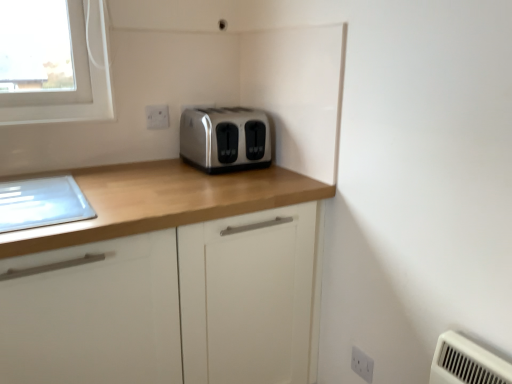
Question: Considering the relative positions of white plastic electric outlet at upper center, acting as the first electric outlet starting from the top, and satin silver toaster at center in the image provided, is white plastic electric outlet at upper center, acting as the first electric outlet starting from the top, to the right of satin silver toaster at center from the viewer's perspective?

Choices:
 (A) no
 (B) yes

Answer: (A)

Question: Is white plastic electric outlet at upper center, positioned as the 1th electric outlet in left-to-right order, aimed at satin silver toaster at center?

Choices:
 (A) yes
 (B) no

Answer: (B)

Question: Is the depth of white plastic electric outlet at upper center, positioned as the 1th electric outlet in left-to-right order, greater than that of satin silver toaster at center?

Choices:
 (A) no
 (B) yes

Answer: (B)

Question: Considering the relative sizes of white plastic electric outlet at upper center, which is the 2th electric outlet in bottom-to-top order, and satin silver toaster at center in the image provided, is white plastic electric outlet at upper center, which is the 2th electric outlet in bottom-to-top order, taller than satin silver toaster at center?

Choices:
 (A) no
 (B) yes

Answer: (A)

Question: Are white plastic electric outlet at upper center, which is the 2th electric outlet in bottom-to-top order, and satin silver toaster at center located far from each other?

Choices:
 (A) yes
 (B) no

Answer: (B)

Question: Considering the relative sizes of white plastic electric outlet at upper center, which is the second electric outlet from front to back, and satin silver toaster at center in the image provided, is white plastic electric outlet at upper center, which is the second electric outlet from front to back, thinner than satin silver toaster at center?

Choices:
 (A) yes
 (B) no

Answer: (A)

Question: From the image's perspective, is white plastic electric outlet at lower right, arranged as the 1th electric outlet when viewed from the front, beneath matte wood cabinet at center?

Choices:
 (A) no
 (B) yes

Answer: (B)

Question: From a real-world perspective, is white plastic electric outlet at lower right, the 2th electric outlet in the back-to-front sequence, physically above matte wood cabinet at center?

Choices:
 (A) yes
 (B) no

Answer: (B)

Question: Does white plastic electric outlet at lower right, acting as the 1th electric outlet starting from the right, lie behind matte wood cabinet at center?

Choices:
 (A) no
 (B) yes

Answer: (B)

Question: Is white plastic electric outlet at lower right, which is counted as the 2th electric outlet, starting from the left, aimed at matte wood cabinet at center?

Choices:
 (A) no
 (B) yes

Answer: (A)

Question: Would you say white plastic electric outlet at lower right, the 2th electric outlet in the back-to-front sequence, is outside matte wood cabinet at center?

Choices:
 (A) no
 (B) yes

Answer: (B)

Question: From a real-world perspective, is white plastic electric outlet at lower right, acting as the 1th electric outlet starting from the right, located beneath matte wood cabinet at center?

Choices:
 (A) no
 (B) yes

Answer: (B)

Question: Considering the relative sizes of white plastic electric outlet at lower right, arranged as the 1th electric outlet when viewed from the front, and white plastic electric outlet at upper center, acting as the first electric outlet starting from the top, in the image provided, is white plastic electric outlet at lower right, arranged as the 1th electric outlet when viewed from the front, wider than white plastic electric outlet at upper center, acting as the first electric outlet starting from the top,?

Choices:
 (A) yes
 (B) no

Answer: (A)